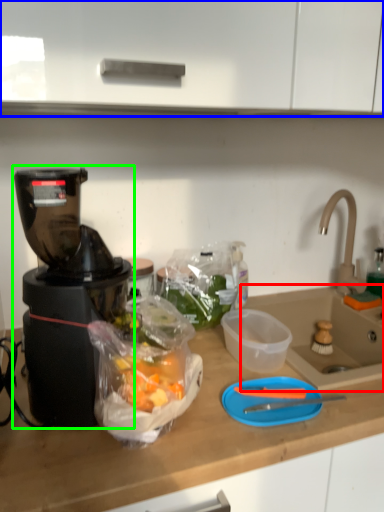
Question: Which is farther away from sink (highlighted by a red box)? cabinetry (highlighted by a blue box) or blender (highlighted by a green box)?

Choices:
 (A) cabinetry
 (B) blender

Answer: (A)